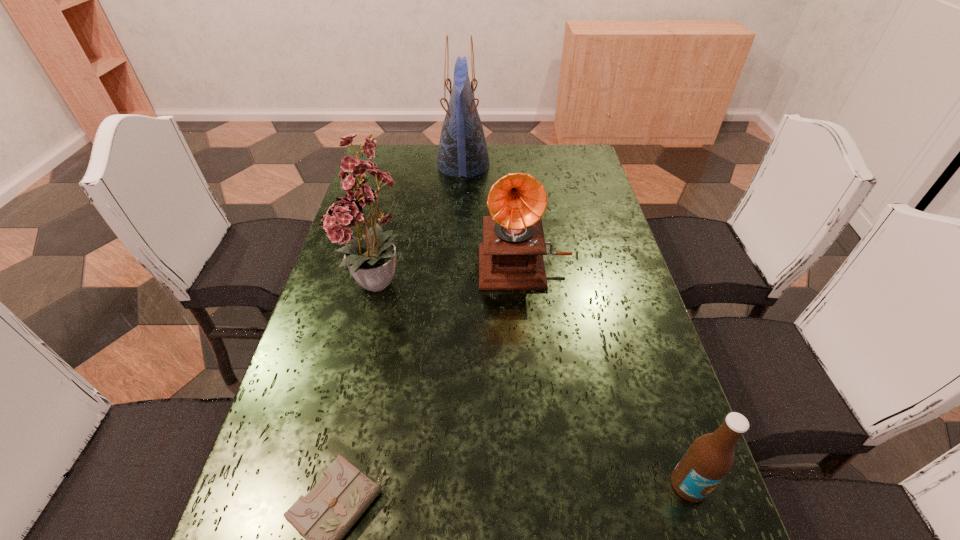
Where is `free space between the flower arrangement and the farthest object`? The image size is (960, 540). free space between the flower arrangement and the farthest object is located at coordinates (421, 225).

Image resolution: width=960 pixels, height=540 pixels. In order to click on vacant space in between the flower arrangement and the fourth tallest object in this screenshot , I will do `click(534, 386)`.

Locate an element on the screen. This screenshot has width=960, height=540. object that stands as the third closest to the farthest object is located at coordinates (323, 517).

In order to click on object that is the third closest one to the diary in this screenshot , I will do `click(710, 457)`.

The height and width of the screenshot is (540, 960). I want to click on vacant area that satisfies the following two spatial constraints: 1. on the front-facing side of the flower arrangement; 2. on the right side of the beer bottle, so (x=334, y=484).

At what (x,y) coordinates should I click in order to perform the action: click on blank area in the image that satisfies the following two spatial constraints: 1. on the horn of the third shortest object; 2. on the right side of the rightmost object. Please return your answer as a coordinate pair (x, y). This screenshot has height=540, width=960. Looking at the image, I should click on (547, 484).